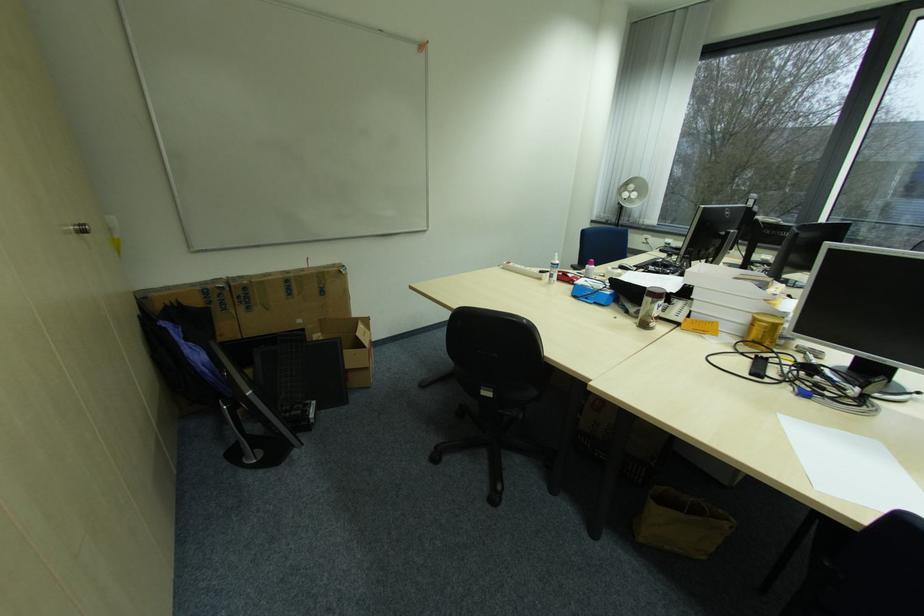
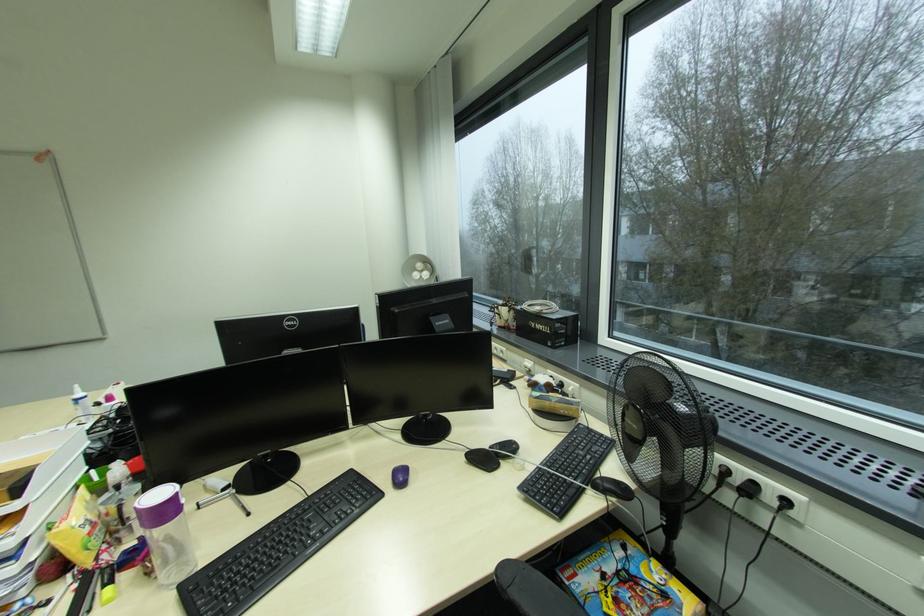
Question: What movement of the cameraman would produce the second image?

Choices:
 (A) Left
 (B) Right
 (C) Forward
 (D) Backward

Answer: (B)